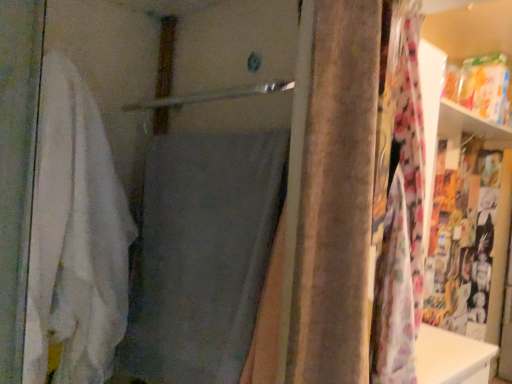
At what (x,y) coordinates should I click in order to perform the action: click on gray fabric bath towel at center, arranged as the first bath towel when viewed from the right. Please return your answer as a coordinate pair (x, y). The image size is (512, 384). Looking at the image, I should click on (201, 255).

Would you say velvet brown curtain at center is part of white soft towel at left, acting as the first bath towel starting from the left,'s contents?

Definitely not — velvet brown curtain at center is not inside white soft towel at left, acting as the first bath towel starting from the left.

Between white soft towel at left, acting as the first bath towel starting from the left, and velvet brown curtain at center, which one has less height?

velvet brown curtain at center.

In the scene shown: Considering the relative sizes of white soft towel at left, acting as the first bath towel starting from the left, and velvet brown curtain at center in the image provided, is white soft towel at left, acting as the first bath towel starting from the left, thinner than velvet brown curtain at center?

No.

Which of these two, white soft towel at left, which appears as the 2th bath towel when viewed from the right, or velvet brown curtain at center, is smaller?

velvet brown curtain at center is smaller.

The image size is (512, 384). In order to click on bath towel lying behind the gray fabric bath towel at center, the 2th bath towel positioned from the left in this screenshot , I will do `click(75, 237)`.

Does gray fabric bath towel at center, the 2th bath towel positioned from the left, turn towards white soft towel at left, acting as the first bath towel starting from the left?

Yes.

Is gray fabric bath towel at center, arranged as the first bath towel when viewed from the right, closer to camera compared to white soft towel at left, acting as the first bath towel starting from the left?

Yes, it is.

From the image's perspective, which one is positioned lower, gray fabric bath towel at center, the 2th bath towel positioned from the left, or white soft towel at left, which appears as the 2th bath towel when viewed from the right?

From the image's view, gray fabric bath towel at center, the 2th bath towel positioned from the left, is below.

Is velvet brown curtain at center closer to camera compared to gray fabric bath towel at center, arranged as the first bath towel when viewed from the right?

Yes, it is.

From the image's perspective, which one is positioned lower, velvet brown curtain at center or gray fabric bath towel at center, arranged as the first bath towel when viewed from the right?

From the image's view, gray fabric bath towel at center, arranged as the first bath towel when viewed from the right, is below.

Can you confirm if velvet brown curtain at center is positioned to the right of gray fabric bath towel at center, arranged as the first bath towel when viewed from the right?

Yes.

Which of these two, velvet brown curtain at center or gray fabric bath towel at center, arranged as the first bath towel when viewed from the right, is thinner?

Thinner between the two is gray fabric bath towel at center, arranged as the first bath towel when viewed from the right.

Which object is further away from the camera taking this photo, gray fabric bath towel at center, arranged as the first bath towel when viewed from the right, or velvet brown curtain at center?

gray fabric bath towel at center, arranged as the first bath towel when viewed from the right, is more distant.

Considering the sizes of objects gray fabric bath towel at center, the 2th bath towel positioned from the left, and velvet brown curtain at center in the image provided, who is taller, gray fabric bath towel at center, the 2th bath towel positioned from the left, or velvet brown curtain at center?

velvet brown curtain at center.

Is white soft towel at left, which appears as the 2th bath towel when viewed from the right, in front of or behind gray fabric bath towel at center, the 2th bath towel positioned from the left, in the image?

Visually, white soft towel at left, which appears as the 2th bath towel when viewed from the right, is located behind gray fabric bath towel at center, the 2th bath towel positioned from the left.

Consider the image. Can you confirm if white soft towel at left, acting as the first bath towel starting from the left, is smaller than gray fabric bath towel at center, the 2th bath towel positioned from the left?

No.

Is white soft towel at left, acting as the first bath towel starting from the left, aimed at gray fabric bath towel at center, arranged as the first bath towel when viewed from the right?

Yes, white soft towel at left, acting as the first bath towel starting from the left, is aimed at gray fabric bath towel at center, arranged as the first bath towel when viewed from the right.

Image resolution: width=512 pixels, height=384 pixels. Identify the location of curtain that appears above the white soft towel at left, which appears as the 2th bath towel when viewed from the right (from the image's perspective). (349, 208).

Based on the photo, who is more distant, velvet brown curtain at center or white soft towel at left, which appears as the 2th bath towel when viewed from the right?

white soft towel at left, which appears as the 2th bath towel when viewed from the right, is behind.

Is velvet brown curtain at center spatially inside white soft towel at left, acting as the first bath towel starting from the left, or outside of it?

velvet brown curtain at center is not inside white soft towel at left, acting as the first bath towel starting from the left, it's outside.

Based on the photo, between velvet brown curtain at center and white soft towel at left, acting as the first bath towel starting from the left, which one has larger size?

Result: white soft towel at left, acting as the first bath towel starting from the left, is bigger.

Starting from the velvet brown curtain at center, which bath towel is the 2nd one behind? Please provide its 2D coordinates.

[(75, 237)]

You are a GUI agent. You are given a task and a screenshot of the screen. Output one action in this format:
    pyautogui.click(x=<x>, y=<y>)
    Task: Click on the bath towel that is under the white soft towel at left, which appears as the 2th bath towel when viewed from the right (from a real-world perspective)
    The width and height of the screenshot is (512, 384).
    Given the screenshot: What is the action you would take?
    pyautogui.click(x=201, y=255)

Estimate the real-world distances between objects in this image. Which object is further from velvet brown curtain at center, white soft towel at left, which appears as the 2th bath towel when viewed from the right, or gray fabric bath towel at center, the 2th bath towel positioned from the left?

white soft towel at left, which appears as the 2th bath towel when viewed from the right.

Based on their spatial positions, is white soft towel at left, which appears as the 2th bath towel when viewed from the right, or velvet brown curtain at center closer to gray fabric bath towel at center, the 2th bath towel positioned from the left?

Among the two, white soft towel at left, which appears as the 2th bath towel when viewed from the right, is located nearer to gray fabric bath towel at center, the 2th bath towel positioned from the left.

Looking at this image, which object lies nearer to the anchor point velvet brown curtain at center, gray fabric bath towel at center, arranged as the first bath towel when viewed from the right, or white soft towel at left, acting as the first bath towel starting from the left?

Based on the image, gray fabric bath towel at center, arranged as the first bath towel when viewed from the right, appears to be nearer to velvet brown curtain at center.

When comparing their distances from gray fabric bath towel at center, arranged as the first bath towel when viewed from the right, does velvet brown curtain at center or white soft towel at left, acting as the first bath towel starting from the left, seem closer?

Among the two, white soft towel at left, acting as the first bath towel starting from the left, is located nearer to gray fabric bath towel at center, arranged as the first bath towel when viewed from the right.

Based on the photo, when comparing their distances from white soft towel at left, acting as the first bath towel starting from the left, does velvet brown curtain at center or gray fabric bath towel at center, the 2th bath towel positioned from the left, seem closer?

gray fabric bath towel at center, the 2th bath towel positioned from the left.

From the image, which object appears to be farther from white soft towel at left, which appears as the 2th bath towel when viewed from the right, gray fabric bath towel at center, arranged as the first bath towel when viewed from the right, or velvet brown curtain at center?

Among the two, velvet brown curtain at center is located further to white soft towel at left, which appears as the 2th bath towel when viewed from the right.

Identify the location of bath towel between white soft towel at left, which appears as the 2th bath towel when viewed from the right, and velvet brown curtain at center from left to right. The image size is (512, 384). click(201, 255).